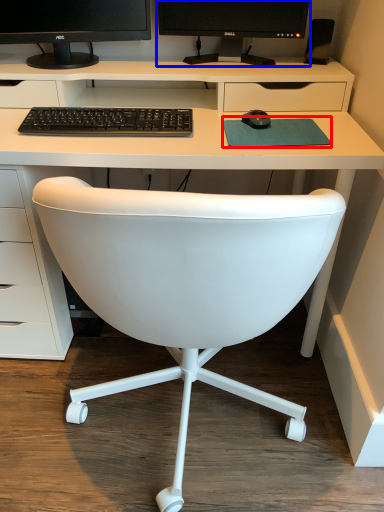
Question: Among these objects, which one is nearest to the camera, mousepad (highlighted by a red box) or computer monitor (highlighted by a blue box)?

Choices:
 (A) mousepad
 (B) computer monitor

Answer: (A)